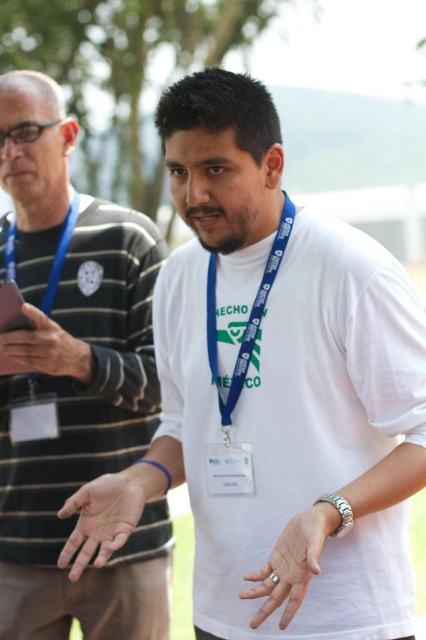
Question: Is white cotton shirt at center above matte white neck at center?

Choices:
 (A) no
 (B) yes

Answer: (A)

Question: Which point is farther to the camera?

Choices:
 (A) white cotton shirt at center
 (B) matte white neck at center
 (C) blue fabric lanyard at center

Answer: (A)

Question: Which is farther from the matte blue lanyard at upper left?

Choices:
 (A) matte white neck at center
 (B) matte black phone at left

Answer: (A)

Question: Can you confirm if blue fabric lanyard at center is wider than matte black phone at left?

Choices:
 (A) no
 (B) yes

Answer: (A)

Question: Can you confirm if white cotton shirt at center is thinner than matte blue lanyard at upper left?

Choices:
 (A) yes
 (B) no

Answer: (B)

Question: Which of the following is the closest to the observer?

Choices:
 (A) blue fabric lanyard at center
 (B) silver metallic ring at center

Answer: (B)